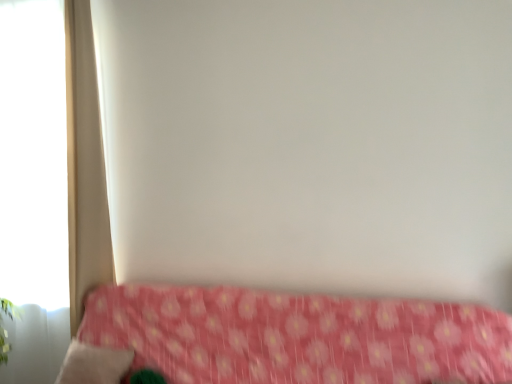
Question: Is beige fabric pillow at lower left inside or outside of pink floral fabric at lower center?

Choices:
 (A) outside
 (B) inside

Answer: (B)

Question: Visually, is beige fabric pillow at lower left positioned to the left or to the right of pink floral fabric at lower center?

Choices:
 (A) left
 (B) right

Answer: (A)

Question: Estimate the real-world distances between objects in this image. Which object is farther from the pink floral fabric at lower center?

Choices:
 (A) white matte window at left
 (B) white fabric curtain at left
 (C) beige fabric pillow at lower left

Answer: (A)

Question: Estimate the real-world distances between objects in this image. Which object is farther from the white fabric curtain at left?

Choices:
 (A) beige fabric pillow at lower left
 (B) white matte window at left
 (C) pink floral fabric at lower center

Answer: (C)